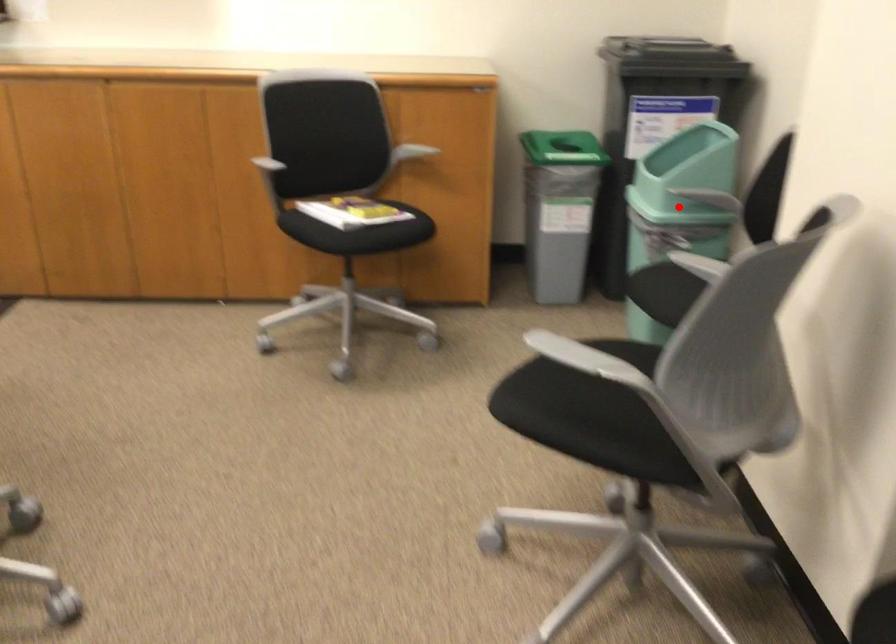
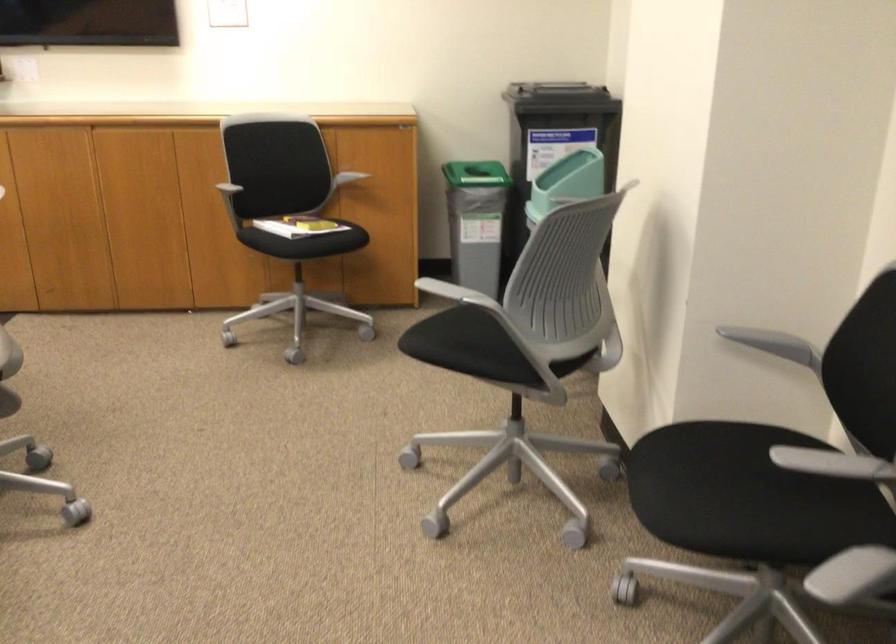
Question: I am providing you with two images of the same scene from different viewpoints. A red point is marked on the first image. Can you still see the location of the red point in image 2?

Choices:
 (A) Yes
 (B) No

Answer: (B)